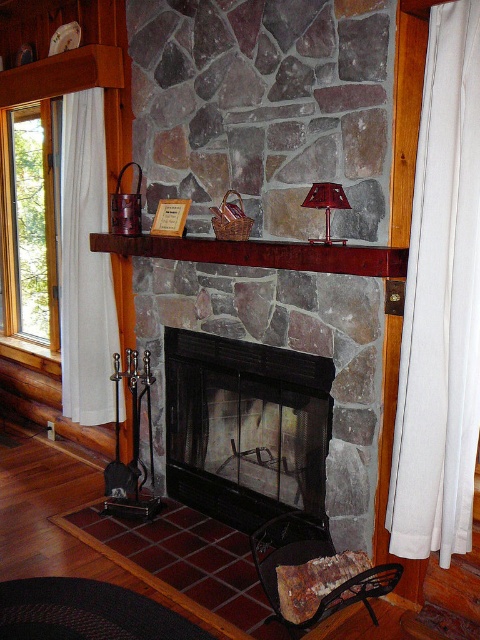
You are planning to hang a new decoration that is the same size as the shiny red glass lamp at center on the mantel shelf. Can the white sheer curtain at right, which is currently occupying space on the mantel, be moved to accommodate the new decoration without overlapping?

The white sheer curtain at right has a larger size compared to the shiny red glass lamp at center. Since the curtain is bigger, moving it might require more space, so it might not be possible to fit both the existing lamp and the new decoration without overlapping.

You are a delivery person trying to place a 30 inch wide package between the white sheer curtain at left and transparent glass window at left. Can you fit it there?

The distance between the white sheer curtain at left and transparent glass window at left is 29.95 inches. The package is 30 inches wide, so it won

You are standing in the room and want to place a 3 meter long shelf between the two points marked as point (x=236, y=483). Will the shelf fit?

The distance between the two points marked as point (x=236, y=483) is 2.85 meters, so the 3 meter long shelf will not fit as it is longer than the available space.